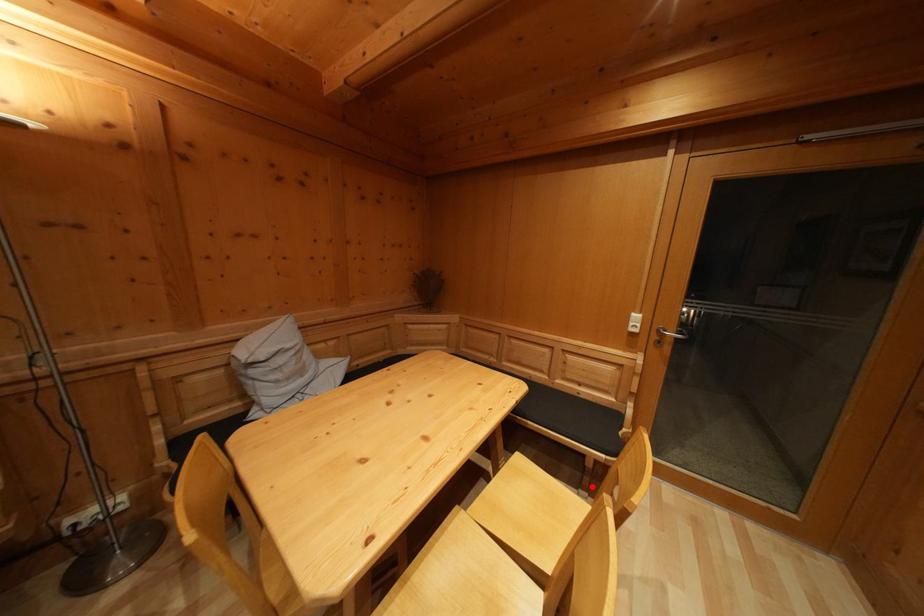
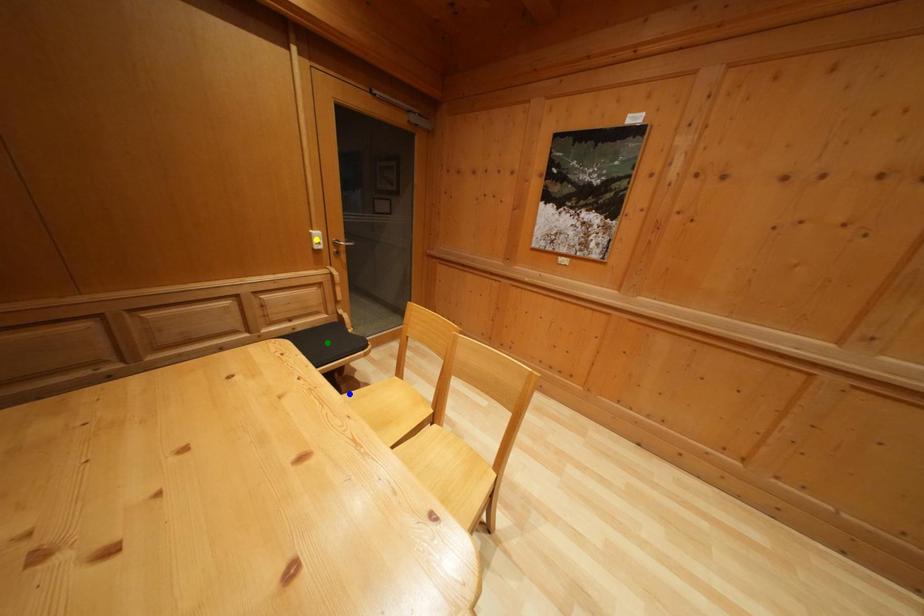
Question: I am providing you with two images of the same scene from different viewpoints. A red point is marked on the first image. You are given multiple points on the second image. Can you choose the point in image 2 that corresponds to the point in image 1?

Choices:
 (A) green point
 (B) blue point
 (C) yellow point

Answer: (B)